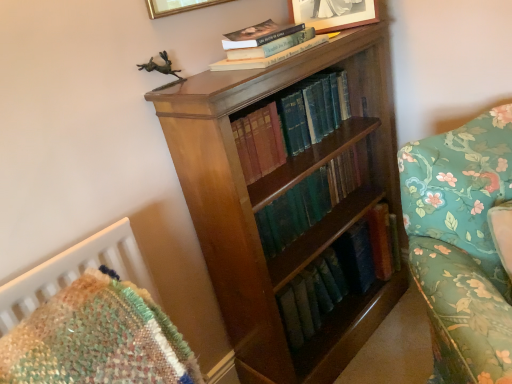
Question: Considering the relative sizes of shiny brown wood bookcase at center and matte silver picture frame at upper center, the 1th picture frame positioned from the right, in the image provided, is shiny brown wood bookcase at center bigger than matte silver picture frame at upper center, the 1th picture frame positioned from the right,?

Choices:
 (A) no
 (B) yes

Answer: (B)

Question: Is shiny brown wood bookcase at center taller than matte silver picture frame at upper center, which is the 2th picture frame in left-to-right order?

Choices:
 (A) no
 (B) yes

Answer: (B)

Question: From the image's perspective, is shiny brown wood bookcase at center on top of matte silver picture frame at upper center, the 1th picture frame positioned from the right?

Choices:
 (A) yes
 (B) no

Answer: (B)

Question: From a real-world perspective, is shiny brown wood bookcase at center located beneath matte silver picture frame at upper center, the 1th picture frame positioned from the right?

Choices:
 (A) yes
 (B) no

Answer: (A)

Question: Is shiny brown wood bookcase at center thinner than matte silver picture frame at upper center, which is the 2th picture frame in left-to-right order?

Choices:
 (A) yes
 (B) no

Answer: (B)

Question: From a real-world perspective, is green leather book at center, which is counted as the 2th book, starting from the bottom, above or below hardcover book at upper center, marked as the third book in a bottom-to-top arrangement?

Choices:
 (A) above
 (B) below

Answer: (B)

Question: From the image's perspective, relative to hardcover book at upper center, which ranks as the first book in top-to-bottom order, is green leather book at center, the second book when ordered from top to bottom, above or below?

Choices:
 (A) below
 (B) above

Answer: (A)

Question: Is green leather book at center, which is counted as the 2th book, starting from the bottom, to the left or to the right of hardcover book at upper center, which ranks as the first book in top-to-bottom order, in the image?

Choices:
 (A) left
 (B) right

Answer: (B)

Question: Is green leather book at center, the second book when ordered from top to bottom, in front of or behind hardcover book at upper center, which ranks as the first book in top-to-bottom order, in the image?

Choices:
 (A) front
 (B) behind

Answer: (B)

Question: Based on their positions, is shiny brown wood bookcase at center located to the left or right of gold metallic picture frame at upper center, the 2th picture frame viewed from the right?

Choices:
 (A) left
 (B) right

Answer: (B)

Question: Relative to gold metallic picture frame at upper center, arranged as the 1th picture frame when viewed from the left, is shiny brown wood bookcase at center in front or behind?

Choices:
 (A) front
 (B) behind

Answer: (B)

Question: Is shiny brown wood bookcase at center spatially inside gold metallic picture frame at upper center, the 2th picture frame viewed from the right, or outside of it?

Choices:
 (A) outside
 (B) inside

Answer: (A)

Question: From a real-world perspective, relative to gold metallic picture frame at upper center, arranged as the 1th picture frame when viewed from the left, is shiny brown wood bookcase at center vertically above or below?

Choices:
 (A) above
 (B) below

Answer: (B)

Question: Relative to gold metallic picture frame at upper center, the 2th picture frame viewed from the right, is matte silver picture frame at upper center, the 1th picture frame positioned from the right, in front or behind?

Choices:
 (A) behind
 (B) front

Answer: (A)

Question: Which is correct: matte silver picture frame at upper center, which is the 2th picture frame in left-to-right order, is inside gold metallic picture frame at upper center, the 2th picture frame viewed from the right, or outside of it?

Choices:
 (A) outside
 (B) inside

Answer: (A)